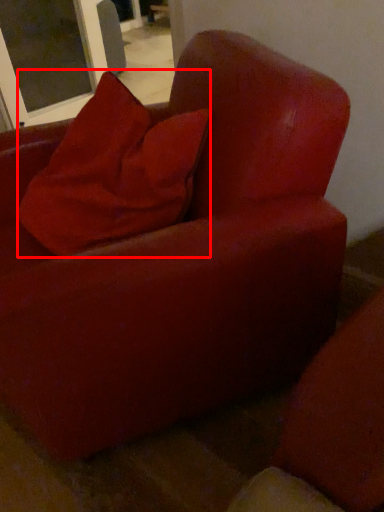
Question: Considering the relative positions of pillow (annotated by the red box) and screen door in the image provided, where is pillow (annotated by the red box) located with respect to the staircase?

Choices:
 (A) right
 (B) left

Answer: (A)